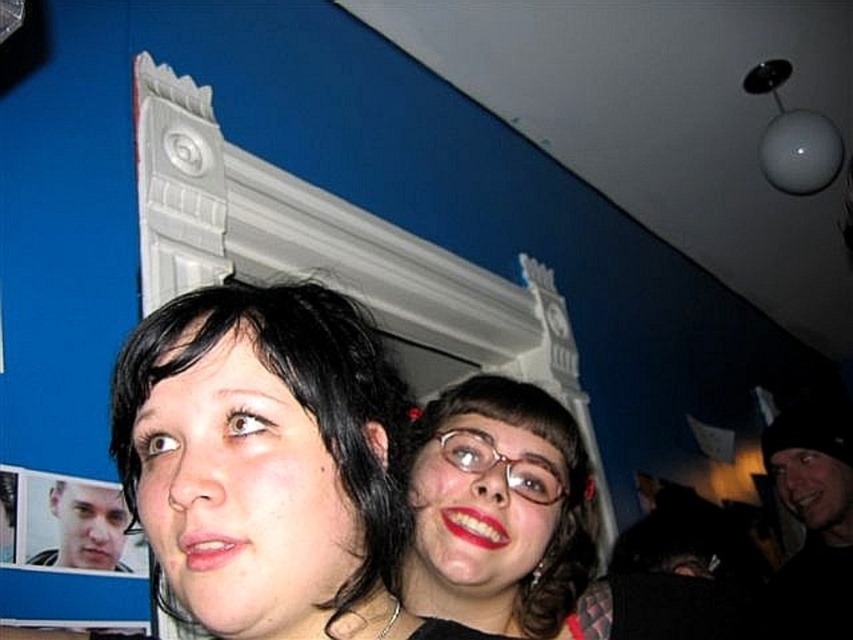
Is dark gray knit hat at right thinner than matte red lipstick at lower center?

No.

Find the location of a particular element. This screenshot has height=640, width=853. dark gray knit hat at right is located at coordinates (814, 516).

Between point (822, 531) and point (202, 560), which one is positioned behind?

Positioned behind is point (822, 531).

You are a GUI agent. You are given a task and a screenshot of the screen. Output one action in this format:
    pyautogui.click(x=<x>, y=<y>)
    Task: Click on the dark gray knit hat at right
    The height and width of the screenshot is (640, 853).
    Given the screenshot: What is the action you would take?
    pyautogui.click(x=814, y=516)

Who is taller, smooth skin face at center or matte black glasses at center?

With more height is matte black glasses at center.

Is the position of smooth skin face at center less distant than that of matte black glasses at center?

That is True.

Between point (165, 429) and point (424, 419), which one is positioned behind?

Point (424, 419)

Where is `smooth skin face at center`? The image size is (853, 640). smooth skin face at center is located at coordinates (265, 458).

How distant is matte red lipstick at lower center from glossy matte lipstick at lower right?

matte red lipstick at lower center and glossy matte lipstick at lower right are 15.07 inches apart.

Which is in front, point (206, 566) or point (491, 516)?

Point (206, 566)

This screenshot has height=640, width=853. I want to click on matte red lipstick at lower center, so click(209, 548).